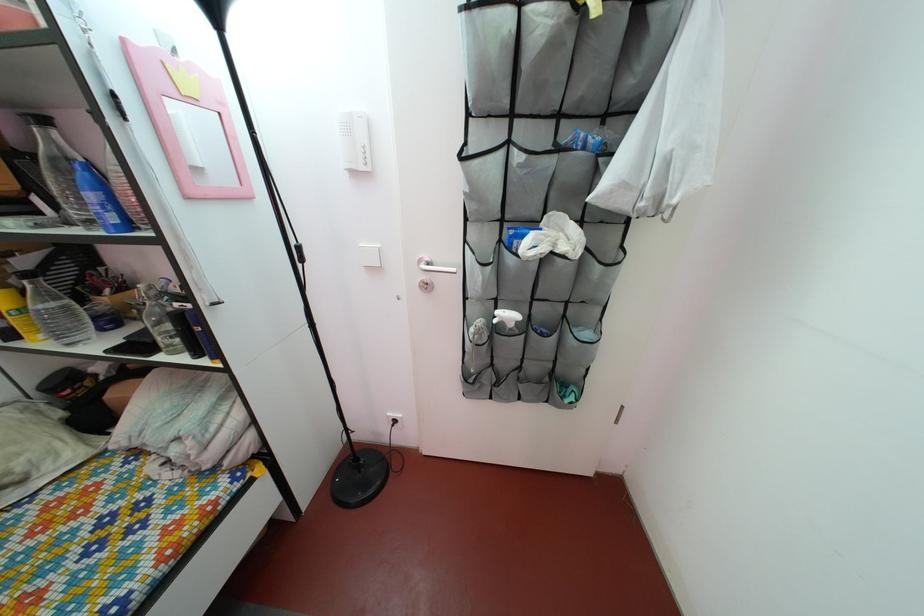
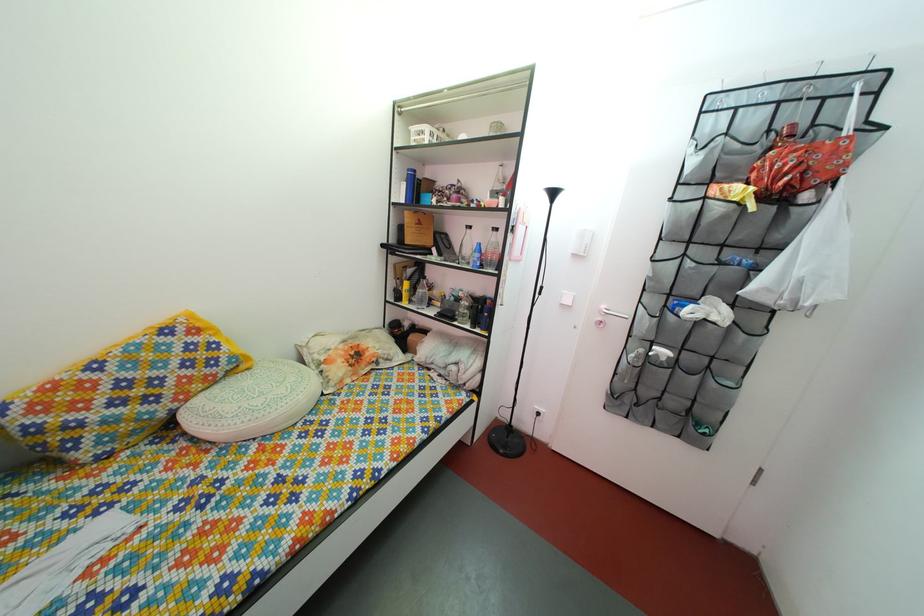
Question: The camera is either moving clockwise (left) or counter-clockwise (right) around the object. The first image is from the beginning of the video and the second image is from the end. Is the camera moving left or right when shooting the video?

Choices:
 (A) Left
 (B) Right

Answer: (B)